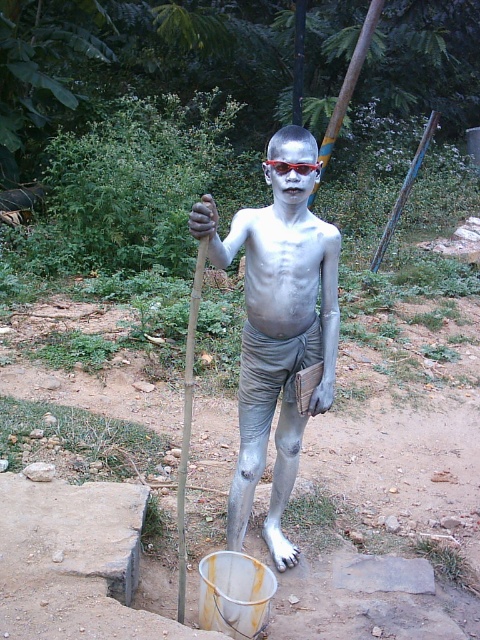
You are a photographer trying to capture a closeup of the matte silver body paint at center. Considering your camera has a minimum focusing distance of 2 meters, will you be able to take the photo without moving closer?

The matte silver body paint at center is 2.15 meters away from camera, so yes, you can take the photo without moving closer since the distance is within the camera minimum focusing distance of 2 meters.

You are a photographer trying to capture the subject in the center. You notice two items of interest at the center area. Which one is positioned to the left when focusing on the matte silver body paint at center and the red plastic goggles at center?

The matte silver body paint at center is positioned to the left of the red plastic goggles at center.